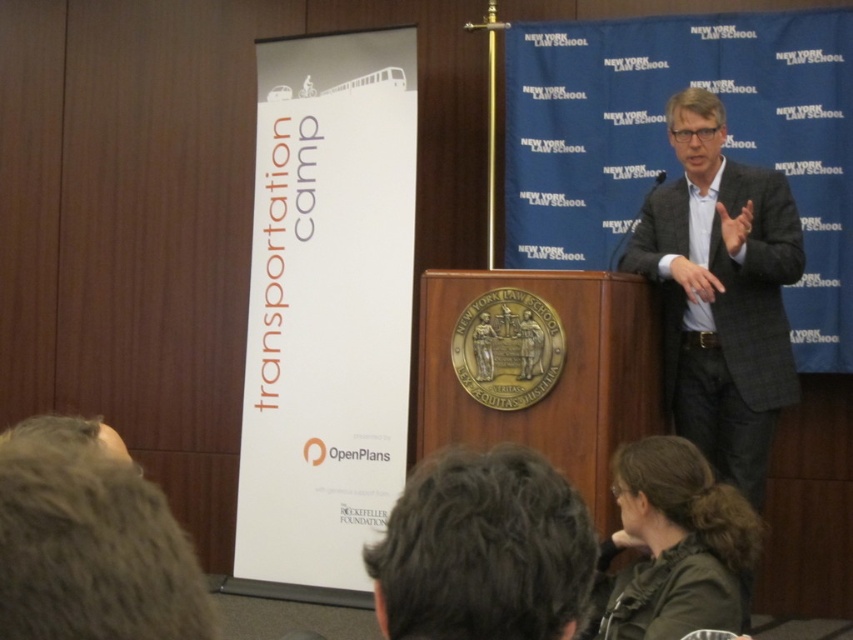
Question: Among these objects, which one is nearest to the camera?

Choices:
 (A) dark green jacket at lower right
 (B) gray woolen suit at upper right

Answer: (A)

Question: Considering the relative positions of gray woolen suit at upper right and dark green jacket at lower right in the image provided, where is gray woolen suit at upper right located with respect to dark green jacket at lower right?

Choices:
 (A) below
 (B) above

Answer: (B)

Question: Where is gray woolen suit at upper right located in relation to dark green jacket at lower right in the image?

Choices:
 (A) left
 (B) right

Answer: (B)

Question: Is gray woolen suit at upper right smaller than dark green jacket at lower right?

Choices:
 (A) no
 (B) yes

Answer: (A)

Question: Among these points, which one is nearest to the camera?

Choices:
 (A) (798, 241)
 (B) (724, 564)

Answer: (B)

Question: Which point appears closest to the camera in this image?

Choices:
 (A) (695, 99)
 (B) (694, 513)

Answer: (B)